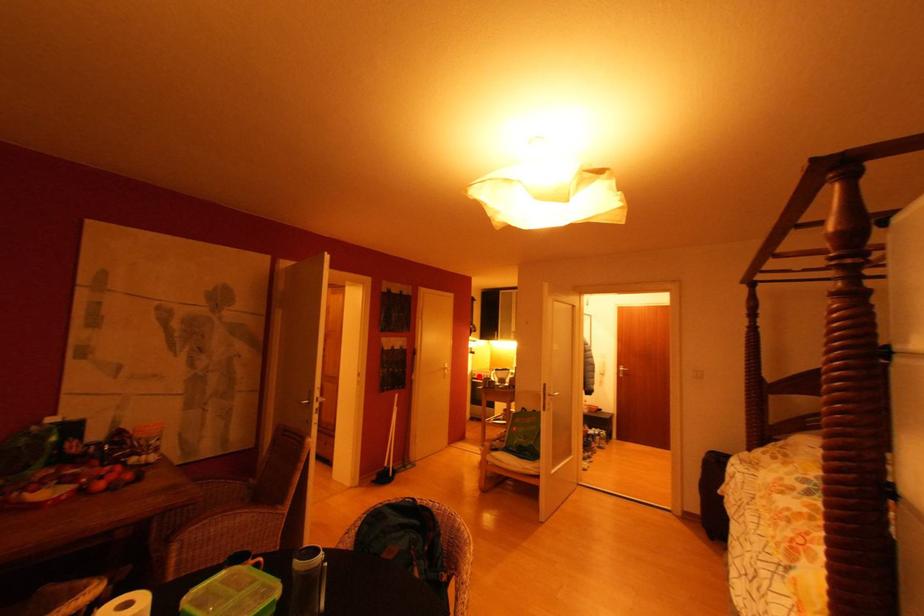
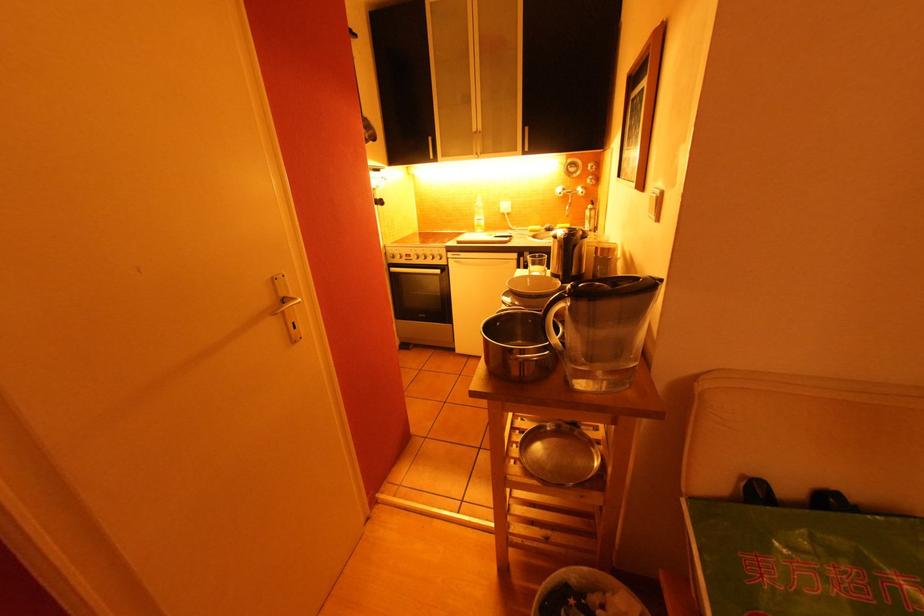
Question: I am providing you with two images of the same scene from different viewpoints. Given a red point in image1, look at the same physical point in image2. Is it:

Choices:
 (A) Closer to the viewpoint
 (B) Farther from the viewpoint

Answer: (A)